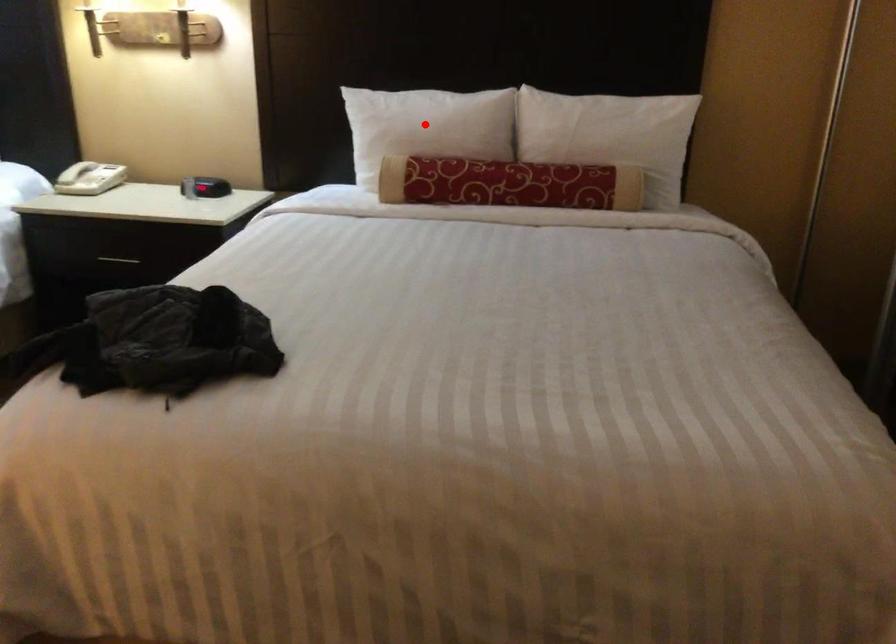
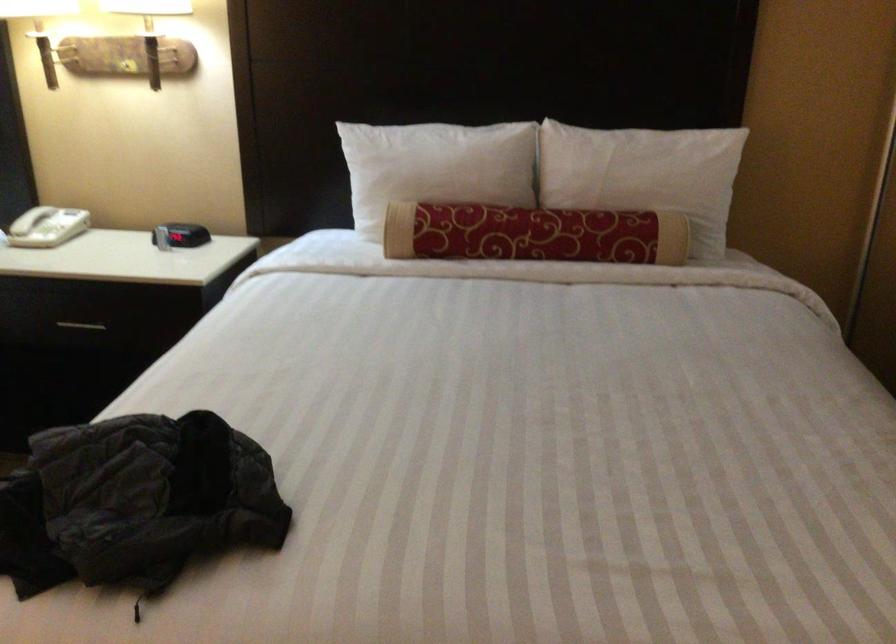
Question: A red point is marked in image1. In image2, is the corresponding 3D point closer to the camera or farther? Reply with the corresponding letter.

Choices:
 (A) The corresponding 3D point is closer.
 (B) The corresponding 3D point is farther.

Answer: (A)